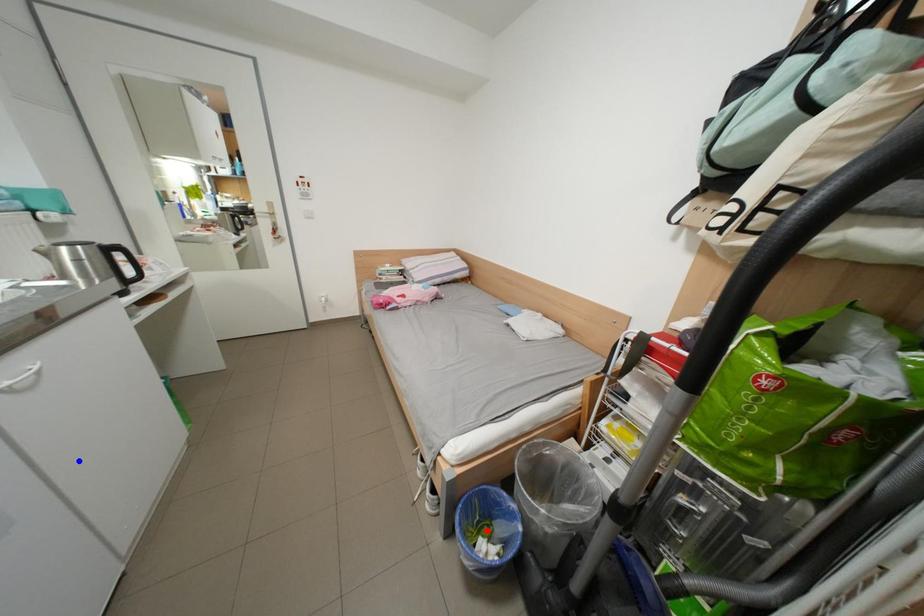
Question: Two points are marked on the image. Which point is closer to the camera?

Choices:
 (A) Blue point is closer.
 (B) Red point is closer.

Answer: (A)